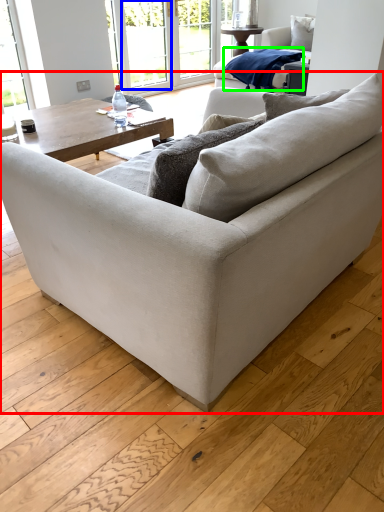
Question: Considering the real-world distances, which object is closest to studio couch (highlighted by a red box)? window screen (highlighted by a blue box) or material (highlighted by a green box).

Choices:
 (A) window screen
 (B) material

Answer: (B)